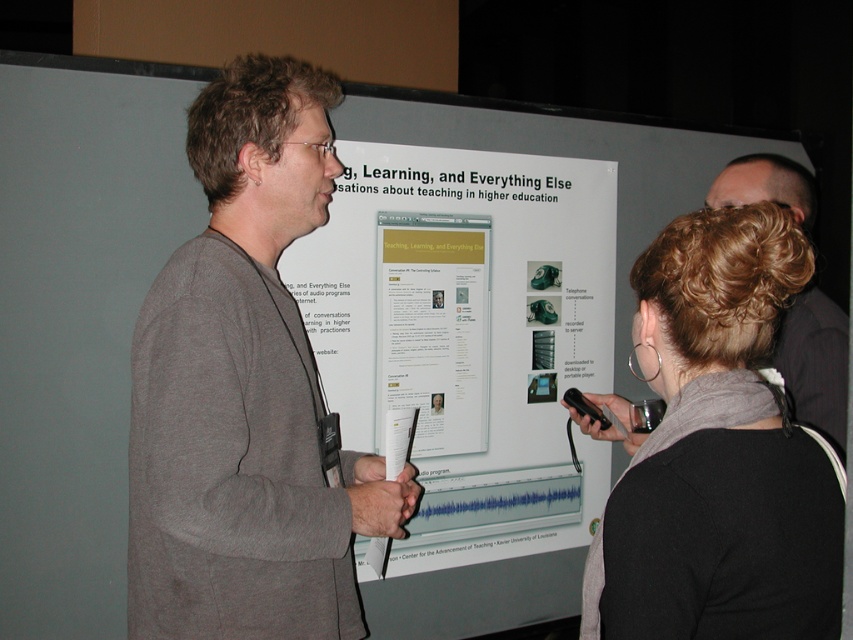
Question: Which point is closer to the camera taking this photo?

Choices:
 (A) (241, 157)
 (B) (473, 381)

Answer: (A)

Question: Is dark brown hair at center above dark gray suit at right?

Choices:
 (A) no
 (B) yes

Answer: (A)

Question: Which of these objects is positioned farthest from the white paper at center?

Choices:
 (A) dark brown hair at center
 (B) white paper poster at center
 (C) gray cotton shirt at center

Answer: (A)

Question: In this image, where is white paper poster at center located relative to gray cotton shirt at center?

Choices:
 (A) left
 (B) right

Answer: (B)

Question: In this image, where is dark brown hair at center located relative to white paper at center?

Choices:
 (A) left
 (B) right

Answer: (B)

Question: Which of the following is the closest to the observer?

Choices:
 (A) (503, 401)
 (B) (230, 195)

Answer: (B)